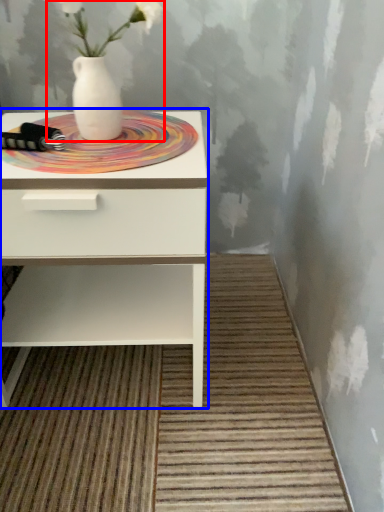
Question: Which object is closer to the camera taking this photo, floral arrangement (highlighted by a red box) or nightstand (highlighted by a blue box)?

Choices:
 (A) floral arrangement
 (B) nightstand

Answer: (A)